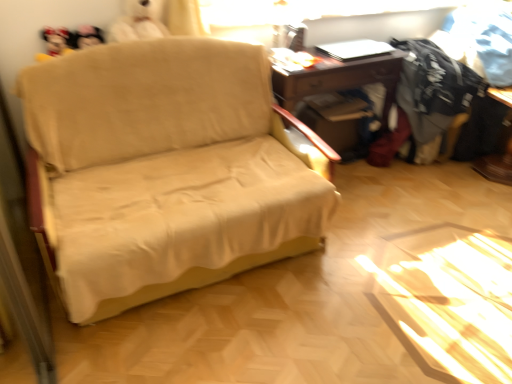
Question: Considering the relative sizes of beige fabric couch at center and dark gray cotton shirt at right, which is the 2th clothing in right-to-left order, in the image provided, is beige fabric couch at center wider than dark gray cotton shirt at right, which is the 2th clothing in right-to-left order,?

Choices:
 (A) no
 (B) yes

Answer: (B)

Question: Is beige fabric couch at center far away from dark gray cotton shirt at right, arranged as the 1th clothing when viewed from the left?

Choices:
 (A) no
 (B) yes

Answer: (B)

Question: Are beige fabric couch at center and dark gray cotton shirt at right, which is the 2th clothing in right-to-left order, beside each other?

Choices:
 (A) yes
 (B) no

Answer: (B)

Question: From the image's perspective, is beige fabric couch at center located beneath dark gray cotton shirt at right, arranged as the 1th clothing when viewed from the left?

Choices:
 (A) no
 (B) yes

Answer: (B)

Question: Is beige fabric couch at center surrounding dark gray cotton shirt at right, which is the 2th clothing in right-to-left order?

Choices:
 (A) no
 (B) yes

Answer: (A)

Question: From the image's perspective, is wooden desk at center above or below beige fabric couch at center?

Choices:
 (A) below
 (B) above

Answer: (B)

Question: In terms of width, does wooden desk at center look wider or thinner when compared to beige fabric couch at center?

Choices:
 (A) wide
 (B) thin

Answer: (B)

Question: In the image, is wooden desk at center positioned in front of or behind beige fabric couch at center?

Choices:
 (A) front
 (B) behind

Answer: (B)

Question: Is wooden desk at center taller or shorter than beige fabric couch at center?

Choices:
 (A) short
 (B) tall

Answer: (A)

Question: Is wooden desk at center situated inside black printed fabric at upper right, arranged as the 2th clothing when viewed from the left, or outside?

Choices:
 (A) inside
 (B) outside

Answer: (B)

Question: Based on their sizes in the image, would you say wooden desk at center is bigger or smaller than black printed fabric at upper right, which is the 1th clothing from right to left?

Choices:
 (A) small
 (B) big

Answer: (B)

Question: From the image's perspective, relative to black printed fabric at upper right, which is the 1th clothing from right to left, is wooden desk at center above or below?

Choices:
 (A) below
 (B) above

Answer: (A)

Question: Is point (340, 76) positioned closer to the camera than point (486, 26)?

Choices:
 (A) farther
 (B) closer

Answer: (B)

Question: From the image's perspective, relative to wooden desk at center, is black printed fabric at upper right, which is the 1th clothing from right to left, above or below?

Choices:
 (A) below
 (B) above

Answer: (B)

Question: In the image, is black printed fabric at upper right, arranged as the 2th clothing when viewed from the left, on the left side or the right side of wooden desk at center?

Choices:
 (A) left
 (B) right

Answer: (B)